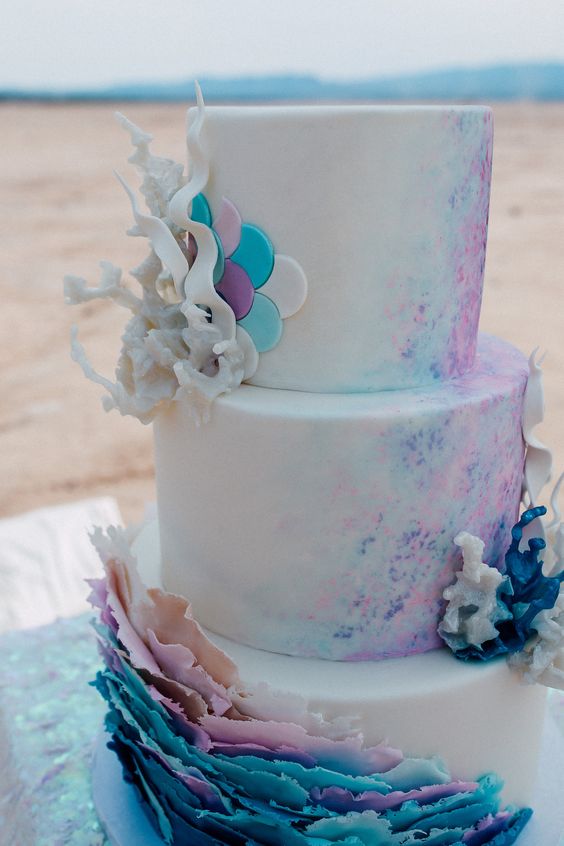
The height and width of the screenshot is (846, 564). Identify the location of white tabletop. point(54,693).